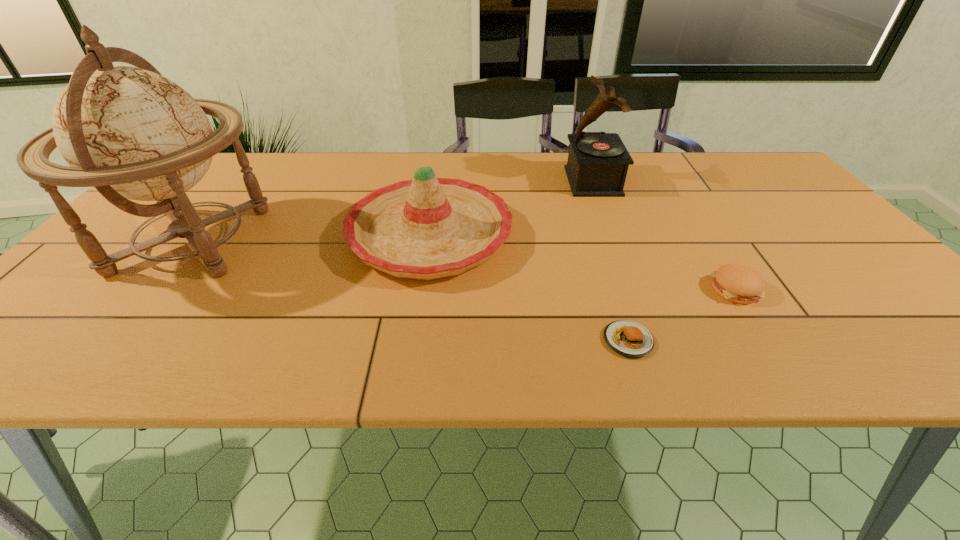
In the image, there is a desktop. What are the coordinates of `free region at the near edge` in the screenshot? It's located at (601, 336).

I want to click on vacant space at the left edge, so click(129, 259).

Locate an element on the screen. free space at the right edge is located at coordinates pos(805,215).

This screenshot has width=960, height=540. Identify the location of free area in between the rightmost object and the shortest object. (682, 315).

Where is `unoccupied area between the fourth shortest object and the second object from left to right`? The width and height of the screenshot is (960, 540). unoccupied area between the fourth shortest object and the second object from left to right is located at coordinates pos(512,208).

This screenshot has height=540, width=960. Find the location of `empty space between the left food and the phonograph_record`. empty space between the left food and the phonograph_record is located at coordinates (611, 261).

Find the location of a particular element. The image size is (960, 540). vacant space that is in between the farther food and the nearest object is located at coordinates (682, 315).

The height and width of the screenshot is (540, 960). I want to click on free spot between the shortest object and the phonograph_record, so click(x=611, y=261).

Where is `empty space that is in between the right food and the third shortest object`? empty space that is in between the right food and the third shortest object is located at coordinates (583, 262).

Identify the location of vacant space that's between the nearest object and the rightmost object. (682, 315).